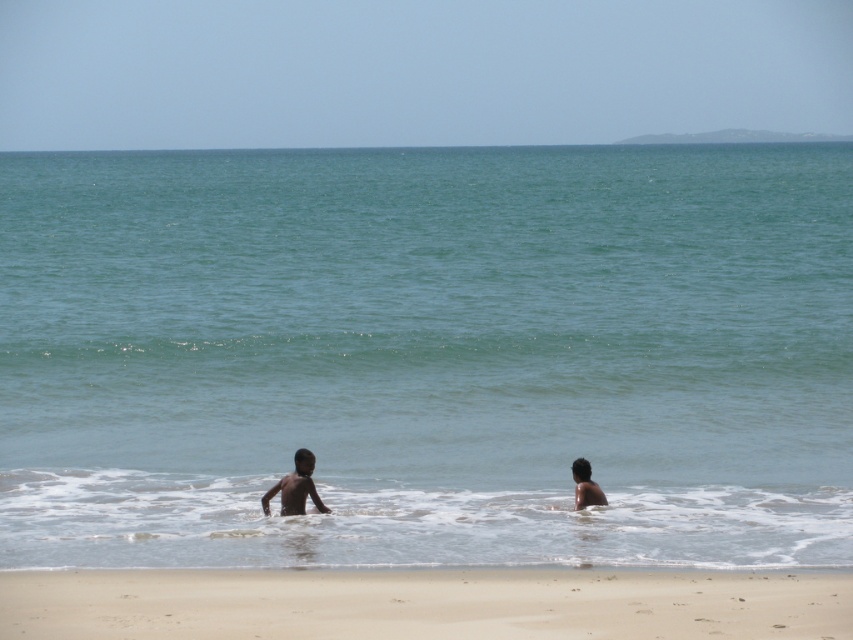
Which is behind, point (18, 314) or point (590, 493)?

The point (18, 314) is behind.

Between point (451, 298) and point (604, 497), which one is positioned in front?

Positioned in front is point (604, 497).

In order to click on clear blue water at center in this screenshot , I will do `click(427, 355)`.

Between point (448, 609) and point (293, 483), which one is positioned behind?

The point (293, 483) is more distant.

Does point (138, 608) come behind point (325, 509)?

That is False.

Find the location of `sandy beach at lower center`. sandy beach at lower center is located at coordinates (422, 604).

Identify the location of sandy beach at lower center. (422, 604).

Which of these two, sandy beach at lower center or dark skin child at lower right, stands shorter?

Standing shorter between the two is sandy beach at lower center.

Is point (242, 628) in front of point (587, 476)?

Yes, point (242, 628) is in front of point (587, 476).

Locate an element on the screen. This screenshot has width=853, height=640. sandy beach at lower center is located at coordinates (422, 604).